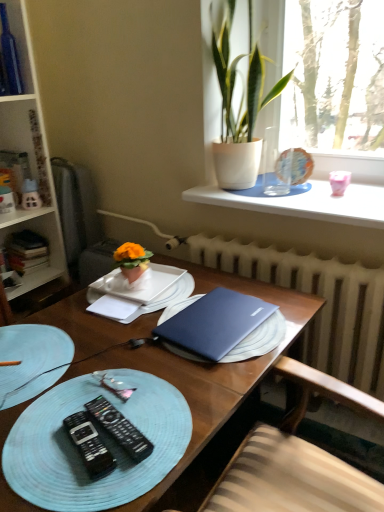
Question: Is satin blue laptop at center spatially inside white matte notebook at center, or outside of it?

Choices:
 (A) inside
 (B) outside

Answer: (B)

Question: Is point (261, 353) positioned closer to the camera than point (87, 307)?

Choices:
 (A) closer
 (B) farther

Answer: (A)

Question: Estimate the real-world distances between objects in this image. Which object is farther from the white smooth window sill at upper center?

Choices:
 (A) satin blue laptop at center
 (B) matte white house at left
 (C) blue woven placemat at lower left, the first tableware viewed from the front
 (D) matte glass globe at upper right, which is counted as the 1th tableware, starting from the right
 (E) hardcover books at left

Answer: (B)

Question: Which object is positioned closest to the light blue woven placemat at lower left?

Choices:
 (A) blue matte laptop at center
 (B) white matte notebook at center
 (C) white smooth window sill at upper center
 (D) green leafy plant at upper right, positioned as the first houseplant in right-to-left order
 (E) matte orange flowerpot at center, which is the second houseplant in top-to-bottom order

Answer: (A)